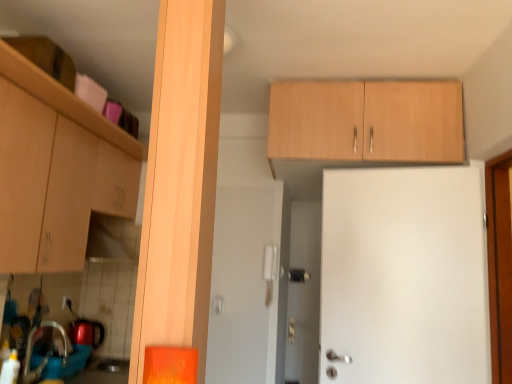
Question: From the image's perspective, does brushed metal sink at lower left appear lower than matte wood cabinet at left, acting as the first cabinetry starting from the left?

Choices:
 (A) yes
 (B) no

Answer: (A)

Question: From a real-world perspective, is brushed metal sink at lower left below matte wood cabinet at left, the 2th cabinetry from the right?

Choices:
 (A) yes
 (B) no

Answer: (A)

Question: From a real-world perspective, is brushed metal sink at lower left on top of matte wood cabinet at left, acting as the first cabinetry starting from the left?

Choices:
 (A) no
 (B) yes

Answer: (A)

Question: Can you confirm if brushed metal sink at lower left is positioned to the left of matte wood cabinet at left, acting as the first cabinetry starting from the left?

Choices:
 (A) no
 (B) yes

Answer: (A)

Question: Does brushed metal sink at lower left have a lesser height compared to matte wood cabinet at left, acting as the first cabinetry starting from the left?

Choices:
 (A) no
 (B) yes

Answer: (B)

Question: Is matte wood cabinet at left, the 2th cabinetry from the right, at the back of brushed metal sink at lower left?

Choices:
 (A) no
 (B) yes

Answer: (A)

Question: Is brushed metal sink at lower left completely or partially inside light wood cabinet at upper center, arranged as the 1th cabinetry when viewed from the right?

Choices:
 (A) yes
 (B) no

Answer: (B)

Question: Is light wood cabinet at upper center, marked as the 2th cabinetry in a left-to-right arrangement, closer to camera compared to brushed metal sink at lower left?

Choices:
 (A) yes
 (B) no

Answer: (B)

Question: Is light wood cabinet at upper center, marked as the 2th cabinetry in a left-to-right arrangement, placed right next to brushed metal sink at lower left?

Choices:
 (A) no
 (B) yes

Answer: (A)

Question: Is light wood cabinet at upper center, marked as the 2th cabinetry in a left-to-right arrangement, shorter than brushed metal sink at lower left?

Choices:
 (A) no
 (B) yes

Answer: (A)

Question: Is light wood cabinet at upper center, arranged as the 1th cabinetry when viewed from the right, thinner than brushed metal sink at lower left?

Choices:
 (A) no
 (B) yes

Answer: (A)

Question: Is light wood cabinet at upper center, marked as the 2th cabinetry in a left-to-right arrangement, further to camera compared to brushed metal sink at lower left?

Choices:
 (A) yes
 (B) no

Answer: (A)

Question: Is light wood cabinet at upper center, marked as the 2th cabinetry in a left-to-right arrangement, next to matte wood cabinet at left, the 2th cabinetry from the right?

Choices:
 (A) no
 (B) yes

Answer: (A)